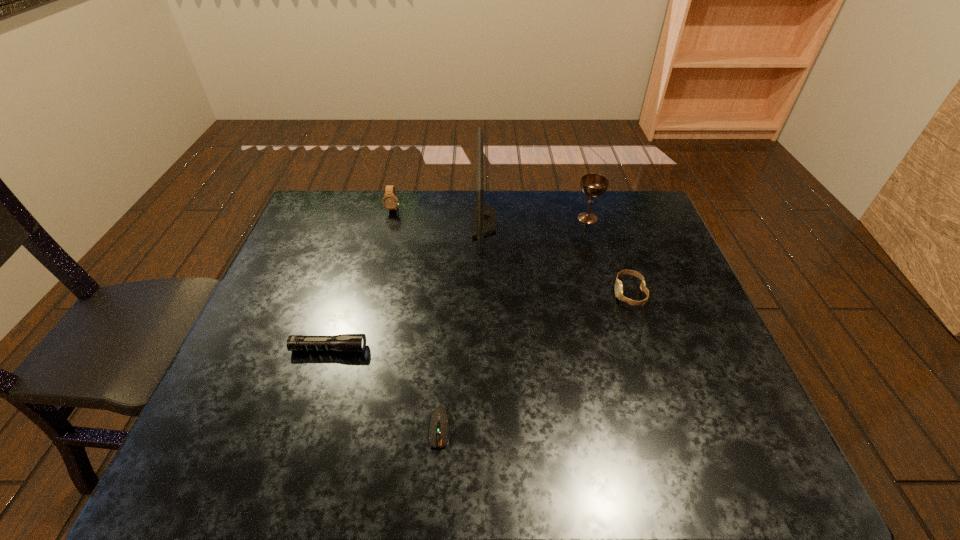
The width and height of the screenshot is (960, 540). I want to click on monitor that is at the far edge, so click(484, 221).

What are the coordinates of `chalice that is at the far edge` in the screenshot? It's located at (592, 185).

At what (x,y) coordinates should I click in order to perform the action: click on watch that is at the far edge. Please return your answer as a coordinate pair (x, y). This screenshot has height=540, width=960. Looking at the image, I should click on (390, 201).

Identify the location of object that is positioned at the near edge. (440, 418).

The height and width of the screenshot is (540, 960). In order to click on object located at the left edge in this screenshot , I will do `click(344, 342)`.

This screenshot has height=540, width=960. I want to click on object positioned at the right edge, so click(618, 284).

Locate an element on the screen. This screenshot has height=540, width=960. vacant space at the far edge of the desktop is located at coordinates (364, 218).

In the image, there is a desktop. At what (x,y) coordinates should I click in order to perform the action: click on vacant space at the near edge. Please return your answer as a coordinate pair (x, y). The height and width of the screenshot is (540, 960). Looking at the image, I should click on (410, 440).

In the image, there is a desktop. Where is `free space at the left edge`? This screenshot has width=960, height=540. free space at the left edge is located at coordinates (229, 434).

This screenshot has width=960, height=540. In order to click on free space at the right edge of the desktop in this screenshot , I will do `click(696, 321)`.